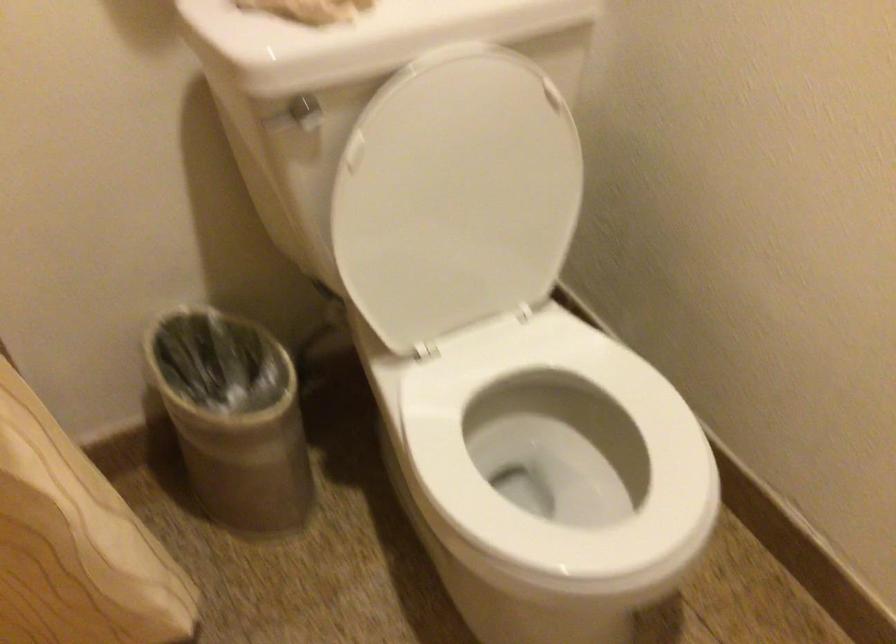
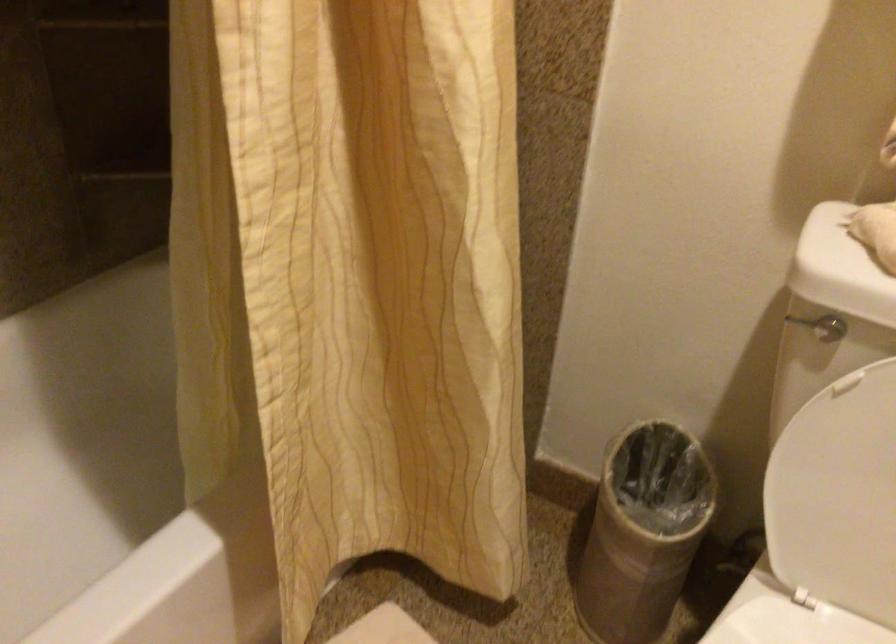
Question: I am providing you with two images of the same scene from different viewpoints. Please identify which objects are invisible in image2.

Choices:
 (A) toilet flush handle
 (B) small trash can
 (C) white toilet lid
 (D) none of these

Answer: (D)